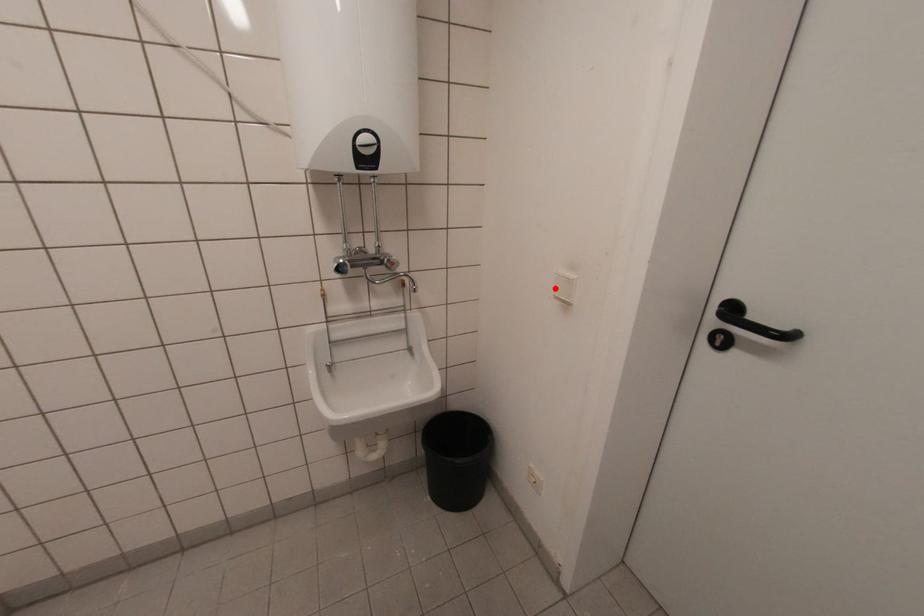
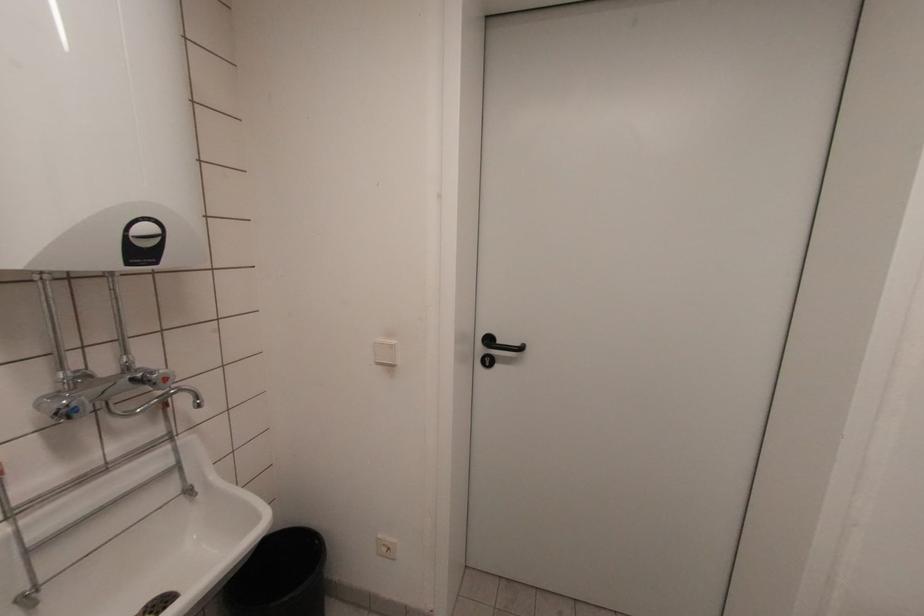
Where in the second image is the point corresponding to the highlighted location from the first image?

(375, 355)